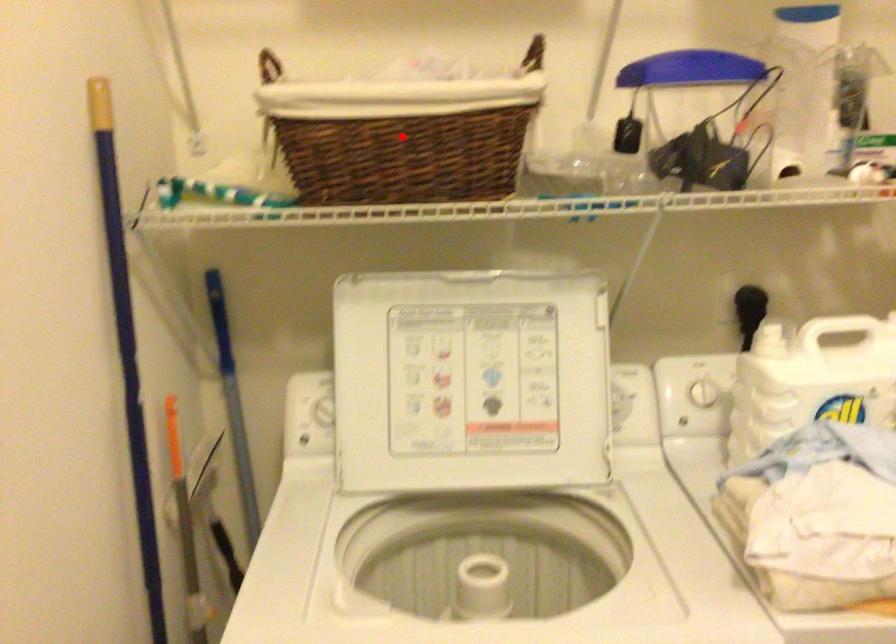
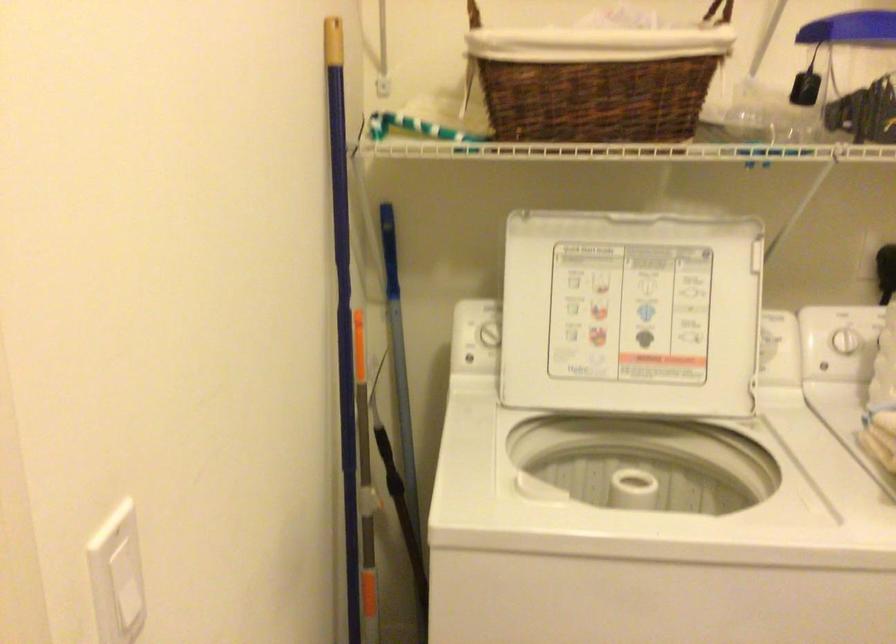
The point at the highlighted location is marked in the first image. Where is the corresponding point in the second image?

(597, 79)